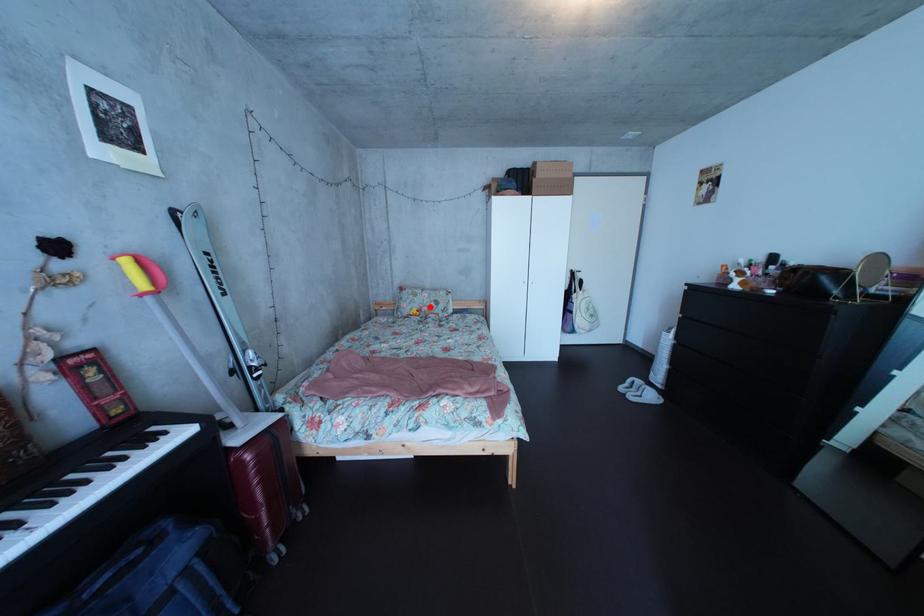
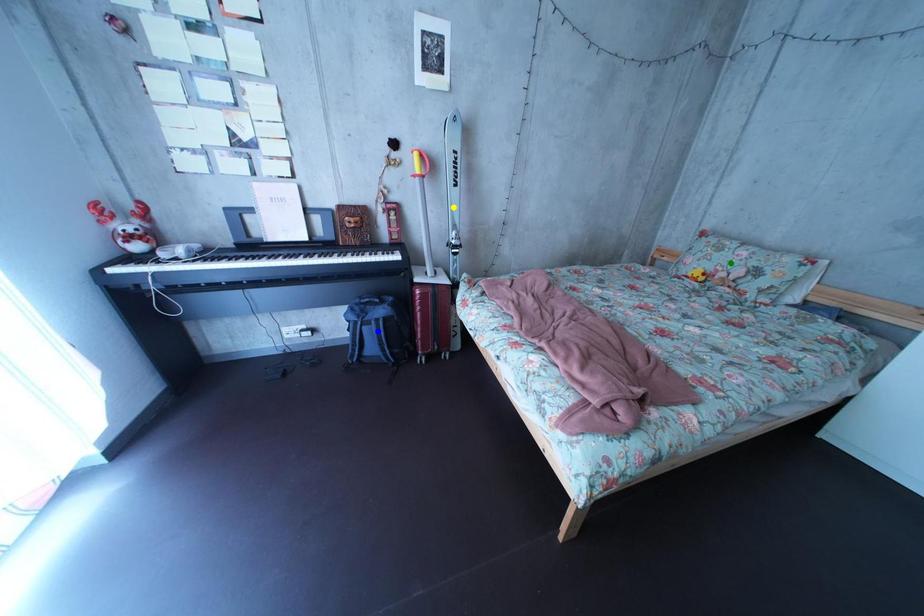
Question: I am providing you with two images of the same scene from different viewpoints. A red point is marked on the first image. You are given multiple points on the second image. Which mark in image 2 goes with the point in image 1?

Choices:
 (A) blue point
 (B) green point
 (C) yellow point

Answer: (B)